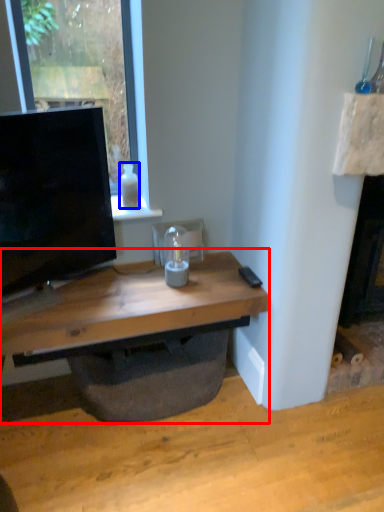
Question: Which object is further to the camera taking this photo, computer desk (highlighted by a red box) or bottle (highlighted by a blue box)?

Choices:
 (A) computer desk
 (B) bottle

Answer: (B)